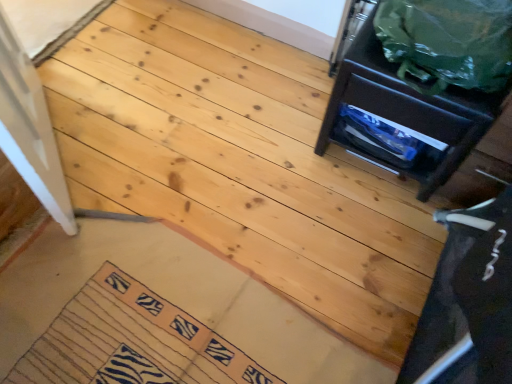
The width and height of the screenshot is (512, 384). Identify the location of free spot to the right of zebra-patterned fabric mat at lower left. (296, 314).